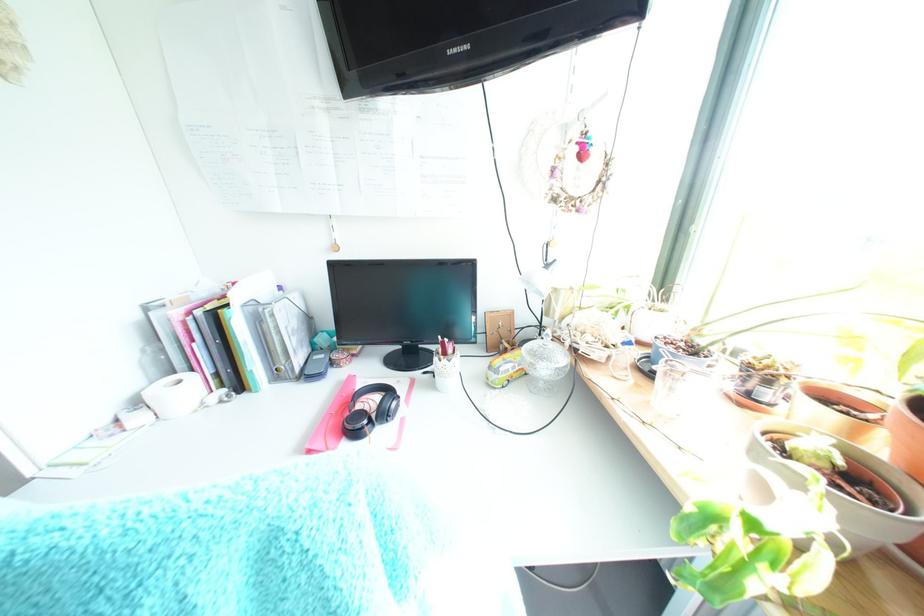
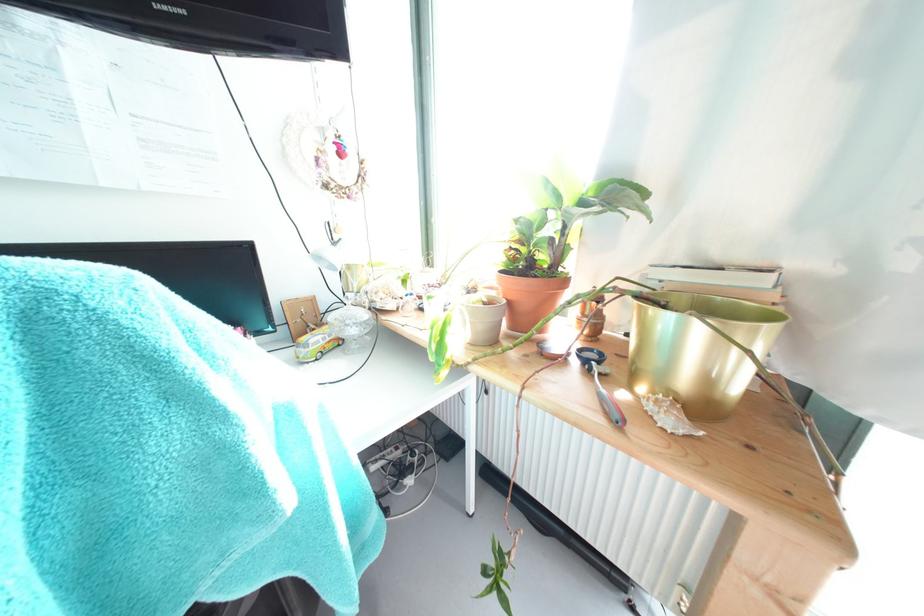
Locate, in the second image, the point that corresponds to point 499,382 in the first image.

(309, 358)